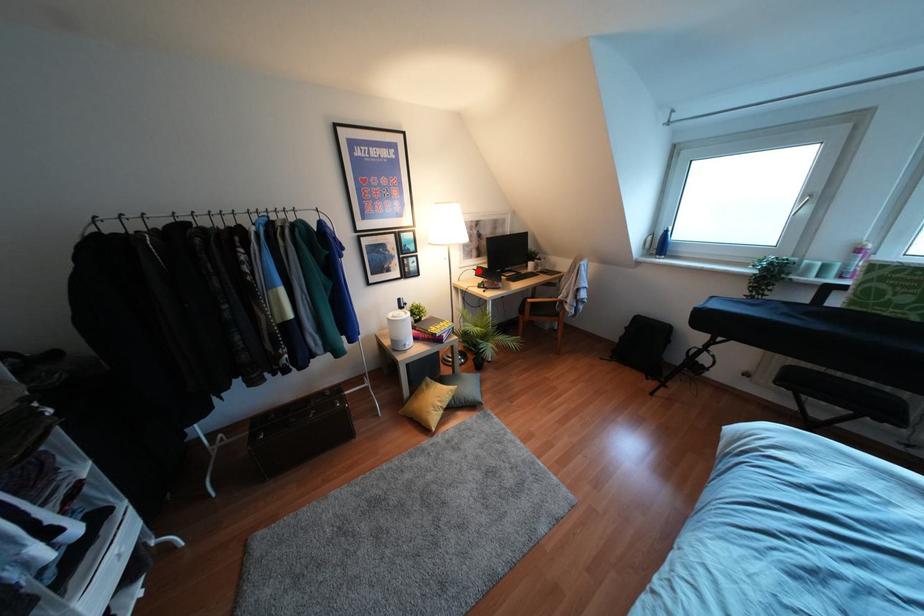
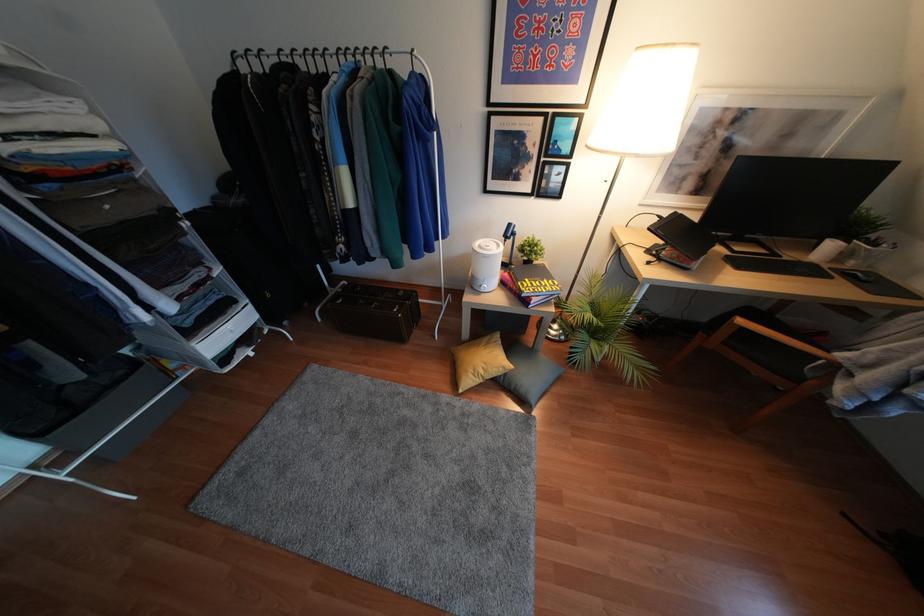
The point at the highlighted location is marked in the first image. Where is the corresponding point in the second image?

(666, 224)